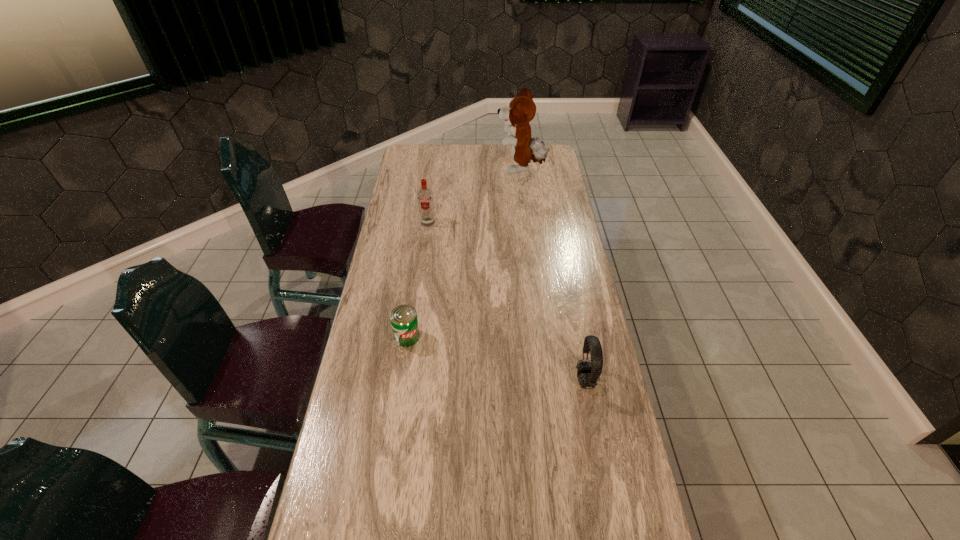
You are a GUI agent. You are given a task and a screenshot of the screen. Output one action in this format:
    pyautogui.click(x=<x>, y=<y>)
    Task: Click on the free space located 0.350m on the face of the tallest object
    
    Given the screenshot: What is the action you would take?
    pyautogui.click(x=420, y=170)

Image resolution: width=960 pixels, height=540 pixels. I want to click on vacant space located on the front label of the second tallest object, so click(418, 300).

Locate an element on the screen. The image size is (960, 540). vacant space located 0.330m on the front-facing side of the nearest object is located at coordinates pos(460,380).

You are a GUI agent. You are given a task and a screenshot of the screen. Output one action in this format:
    pyautogui.click(x=<x>, y=<y>)
    Task: Click on the blank space located 0.100m on the front-facing side of the nearest object
    This screenshot has width=960, height=540.
    Given the screenshot: What is the action you would take?
    pyautogui.click(x=541, y=380)

Where is `free space located 0.360m on the front-facing side of the nearest object`? Image resolution: width=960 pixels, height=540 pixels. free space located 0.360m on the front-facing side of the nearest object is located at coordinates (449, 380).

Where is `free location located 0.080m on the right of the second nearest object`? This screenshot has height=540, width=960. free location located 0.080m on the right of the second nearest object is located at coordinates (445, 336).

This screenshot has width=960, height=540. In order to click on object located at the far edge in this screenshot , I will do `click(521, 110)`.

Image resolution: width=960 pixels, height=540 pixels. I want to click on vodka situated at the left edge, so click(x=425, y=196).

You are a GUI agent. You are given a task and a screenshot of the screen. Output one action in this format:
    pyautogui.click(x=<x>, y=<y>)
    Task: Click on the can positioned at the left edge
    This screenshot has height=540, width=960.
    Given the screenshot: What is the action you would take?
    pyautogui.click(x=404, y=322)

Identify the location of puppy that is at the right edge. The width and height of the screenshot is (960, 540). (521, 110).